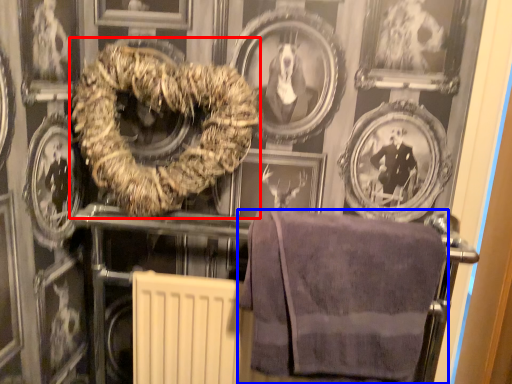
Question: Which object is closer to the camera taking this photo, towel (highlighted by a red box) or towel (highlighted by a blue box)?

Choices:
 (A) towel
 (B) towel

Answer: (B)